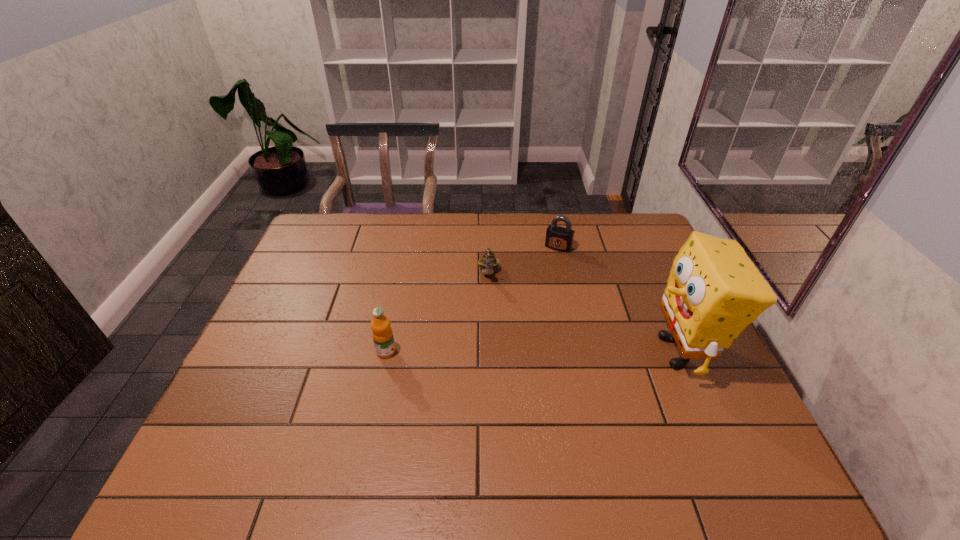
In the image, there is a desktop. Where is `free space at the far edge`? free space at the far edge is located at coordinates (427, 214).

In the image, there is a desktop. At what (x,y) coordinates should I click in order to perform the action: click on vacant space at the near edge. Please return your answer as a coordinate pair (x, y). This screenshot has width=960, height=540. Looking at the image, I should click on (681, 438).

I want to click on free space at the left edge, so click(x=307, y=352).

You are a GUI agent. You are given a task and a screenshot of the screen. Output one action in this format:
    pyautogui.click(x=<x>, y=<y>)
    Task: Click on the free space at the right edge of the desktop
    
    Given the screenshot: What is the action you would take?
    pyautogui.click(x=626, y=253)

Locate an element on the screen. This screenshot has width=960, height=540. free space at the far left corner of the desktop is located at coordinates (351, 224).

The height and width of the screenshot is (540, 960). Identify the location of vacant point located between the second object from right to left and the rightmost object. (619, 299).

I want to click on empty space between the farthest object and the rightmost object, so click(x=619, y=299).

Where is `unoccupied position between the third shortest object and the farthest object`? The width and height of the screenshot is (960, 540). unoccupied position between the third shortest object and the farthest object is located at coordinates (472, 299).

You are a GUI agent. You are given a task and a screenshot of the screen. Output one action in this format:
    pyautogui.click(x=<x>, y=<y>)
    Task: Click on the blank region between the rightmost object and the second farthest object
    
    Given the screenshot: What is the action you would take?
    pyautogui.click(x=585, y=313)

You are a GUI agent. You are given a task and a screenshot of the screen. Output one action in this format:
    pyautogui.click(x=<x>, y=<y>)
    Task: Click on the unoccupied position between the sponge and the third object from left to right
    
    Given the screenshot: What is the action you would take?
    pyautogui.click(x=619, y=299)